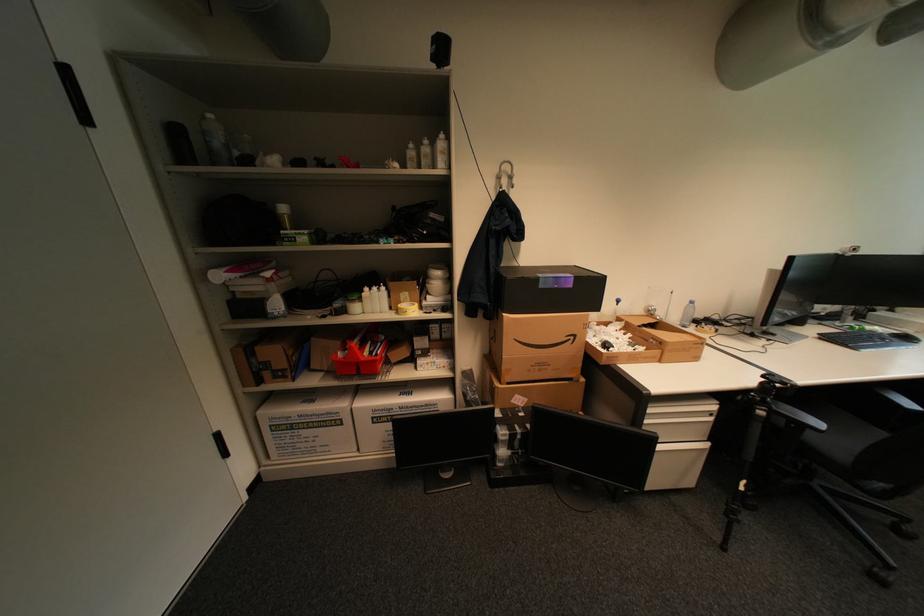
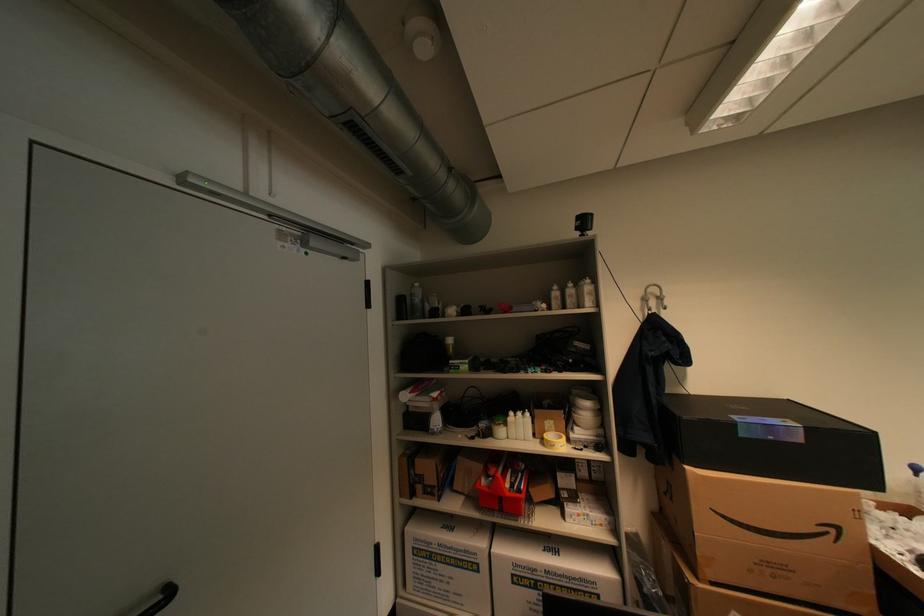
Where in the second image is the point corresponding to [374,290] from the first image?

(519, 414)